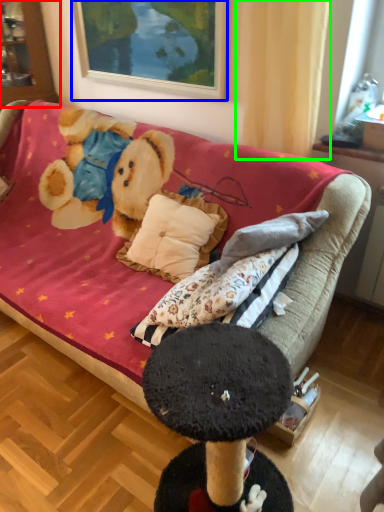
Question: Considering the real-world distances, which object is farthest from cabinetry (highlighted by a red box)? picture frame (highlighted by a blue box) or curtain (highlighted by a green box)?

Choices:
 (A) picture frame
 (B) curtain

Answer: (B)